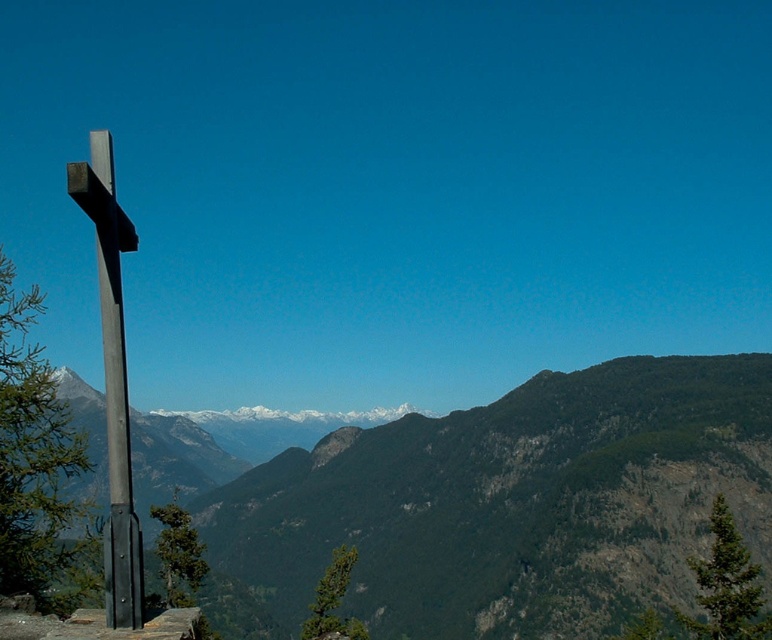
Question: Can you confirm if green textured mountain range at center is smaller than black metal cross at left?

Choices:
 (A) yes
 (B) no

Answer: (B)

Question: Which of the following is the closest to the observer?

Choices:
 (A) (127, 531)
 (B) (346, 476)

Answer: (A)

Question: Does green textured mountain range at center come in front of black metal cross at left?

Choices:
 (A) yes
 (B) no

Answer: (B)

Question: Can you confirm if green textured mountain range at center is positioned to the right of black metal cross at left?

Choices:
 (A) yes
 (B) no

Answer: (A)